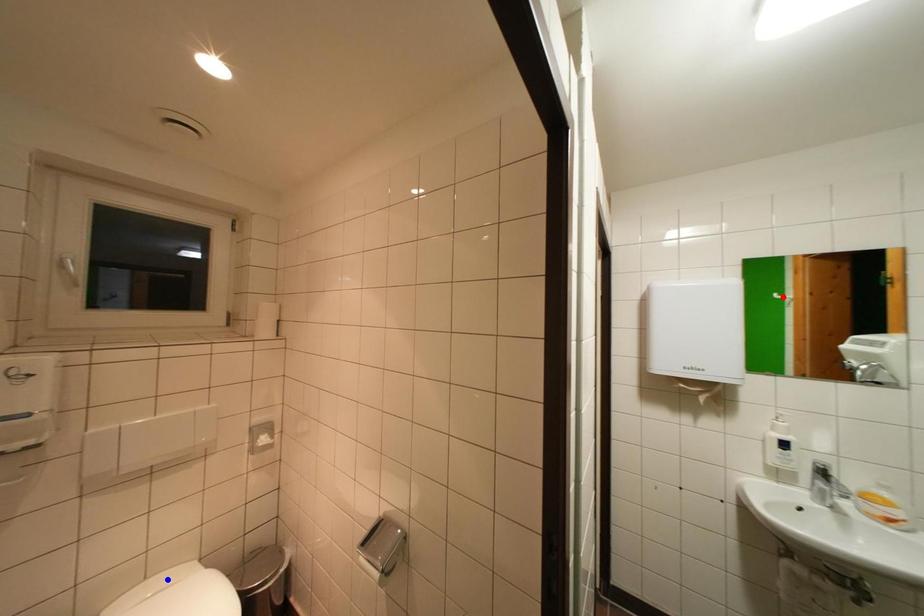
Question: Two points are marked on the image. Which point is closer to the camera?

Choices:
 (A) Blue point is closer.
 (B) Red point is closer.

Answer: (A)